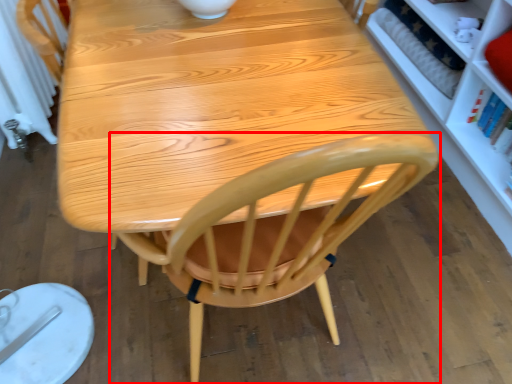
Question: Observing the image, what is the correct spatial positioning of chair (annotated by the red box) in reference to radiator?

Choices:
 (A) right
 (B) left

Answer: (A)